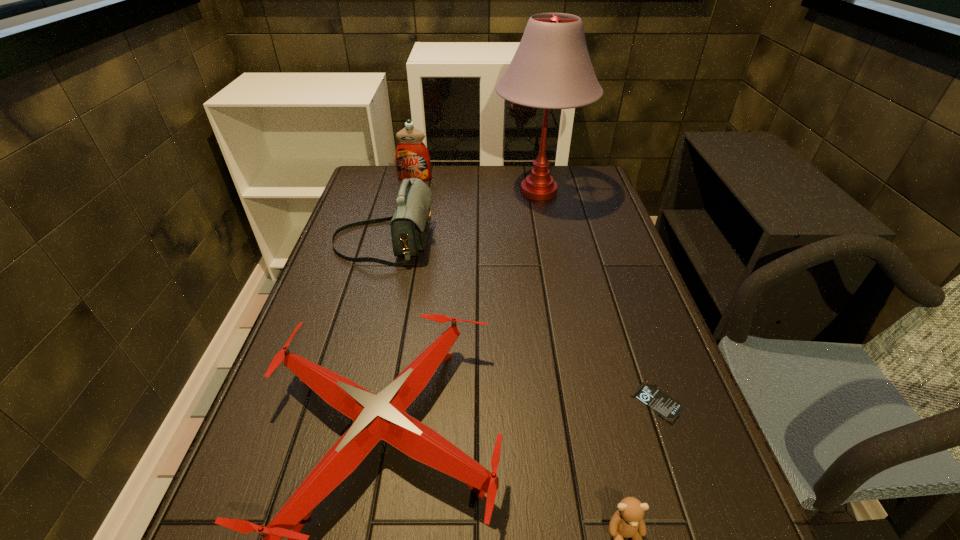
Find the location of a particular element. This screenshot has width=960, height=540. vacant space that satisfies the following two spatial constraints: 1. on the back side of the shortest object; 2. on the front-facing side of the table lamp is located at coordinates (584, 192).